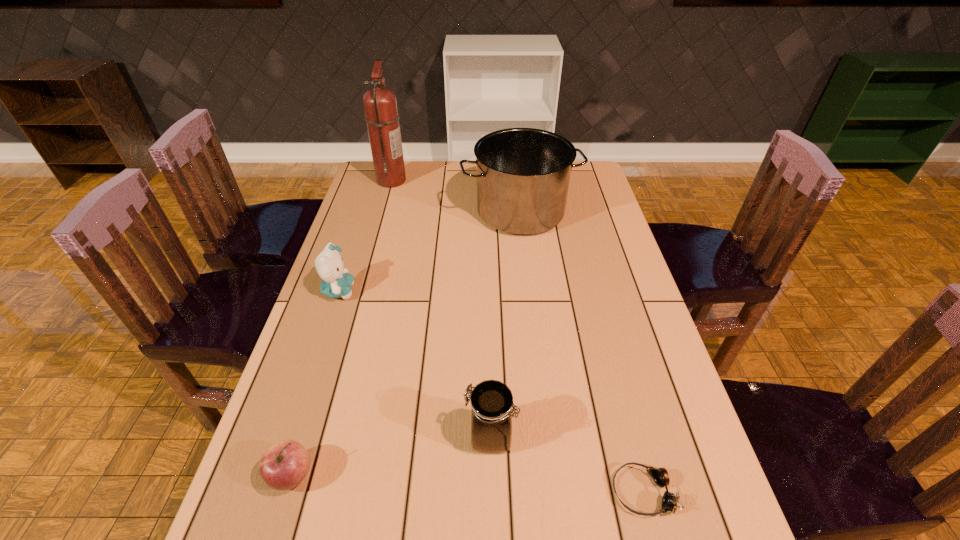
In order to click on apple located in the left edge section of the desktop in this screenshot , I will do `click(284, 465)`.

The width and height of the screenshot is (960, 540). Find the location of `saucepan that is at the right edge`. saucepan that is at the right edge is located at coordinates (523, 174).

At what (x,y) coordinates should I click in order to perform the action: click on goggles that is at the right edge. Please return your answer as a coordinate pair (x, y). The width and height of the screenshot is (960, 540). Looking at the image, I should click on (660, 475).

This screenshot has width=960, height=540. Find the location of `object situated at the far left corner`. object situated at the far left corner is located at coordinates (380, 106).

In order to click on object that is at the far right corner in this screenshot , I will do `click(523, 174)`.

In the image, there is a desktop. Identify the location of vacant space at the far edge. The image size is (960, 540). (455, 162).

I want to click on free point at the left edge, so click(359, 249).

Identify the location of blank space at the right edge of the desktop. This screenshot has height=540, width=960. (614, 335).

Find the location of a particular element. This screenshot has height=540, width=960. vacant area that lies between the fire extinguisher and the third farthest object is located at coordinates (366, 235).

Where is `vacant point located between the tallest object and the kitten`? The width and height of the screenshot is (960, 540). vacant point located between the tallest object and the kitten is located at coordinates (x=366, y=235).